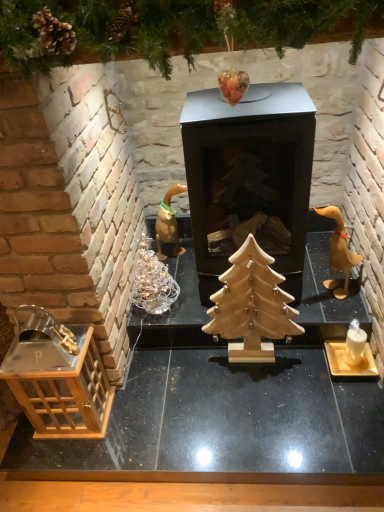
Where is `vacant area located to the right-hand side of transparent glass lantern at lower left`? This screenshot has width=384, height=512. vacant area located to the right-hand side of transparent glass lantern at lower left is located at coordinates (135, 414).